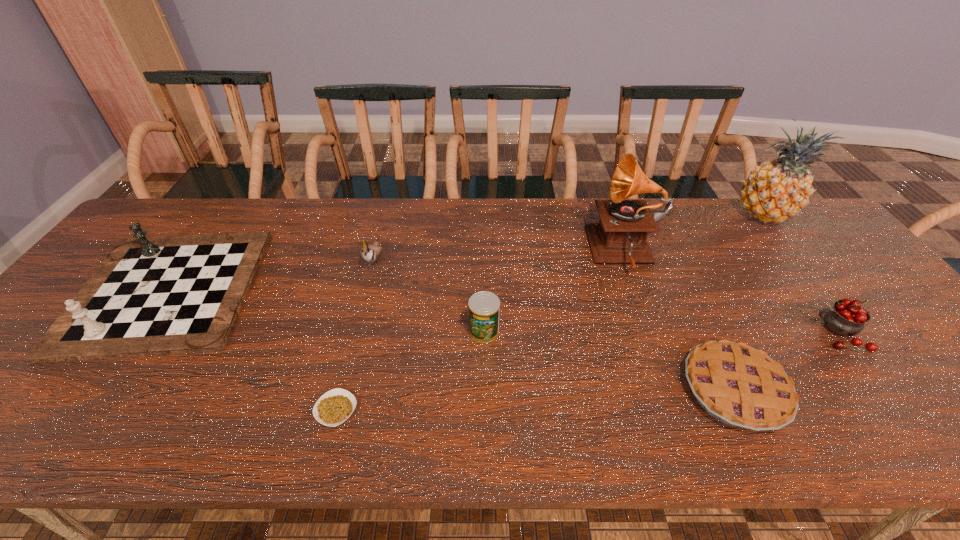
Where is `vacant space located on the horn of the phonograph record`? vacant space located on the horn of the phonograph record is located at coordinates (486, 252).

Identify the location of free region located 0.380m on the horn of the phonograph record. The width and height of the screenshot is (960, 540). (462, 252).

The height and width of the screenshot is (540, 960). Find the location of `vacant area situated on the right of the gameboard`. vacant area situated on the right of the gameboard is located at coordinates (302, 290).

What are the coordinates of `free space located 0.050m at the face of the bird` in the screenshot? It's located at (366, 293).

You are a GUI agent. You are given a task and a screenshot of the screen. Output one action in this format:
    pyautogui.click(x=<x>, y=<y>)
    Task: Click on the free space located 0.280m on the handle side of the cherry
    The height and width of the screenshot is (540, 960).
    Given the screenshot: What is the action you would take?
    pyautogui.click(x=700, y=334)

Locate an element on the screen. This screenshot has height=540, width=960. vacant region located 0.400m on the handle side of the cherry is located at coordinates (651, 334).

Where is `blank space located 0.140m on the handle side of the cherry`? blank space located 0.140m on the handle side of the cherry is located at coordinates (757, 334).

Locate an element on the screen. blank space located on the right of the can is located at coordinates (601, 330).

Where is `vacant space located 0.300m on the back of the second shortest object`? vacant space located 0.300m on the back of the second shortest object is located at coordinates (675, 264).

This screenshot has width=960, height=540. What are the coordinates of `vacant region located on the left of the shortest object` in the screenshot? It's located at (276, 409).